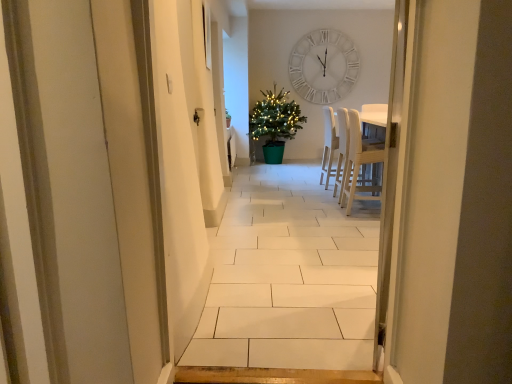
Measure the distance between point (276, 117) and camera.

Point (276, 117) is 6.53 meters from camera.

Image resolution: width=512 pixels, height=384 pixels. Identify the location of white wood chairs at center. (342, 148).

The image size is (512, 384). What do you see at coordinates (342, 148) in the screenshot?
I see `white wood chairs at center` at bounding box center [342, 148].

The height and width of the screenshot is (384, 512). Find the location of `light wood chair at center`. light wood chair at center is located at coordinates (360, 166).

Considering the relative sizes of green matte potted plant at center and light wood chair at center in the image provided, is green matte potted plant at center bigger than light wood chair at center?

Yes.

Considering the relative positions of green matte potted plant at center and light wood chair at center in the image provided, is green matte potted plant at center to the left of light wood chair at center from the viewer's perspective?

Indeed, green matte potted plant at center is positioned on the left side of light wood chair at center.

Which of these two, green matte potted plant at center or light wood chair at center, stands shorter?

With less height is light wood chair at center.

From the image's perspective, is green matte potted plant at center beneath light wood chair at center?

No.

What's the angular difference between light wood chair at center and white wooden clock at upper center's facing directions?

The facing directions of light wood chair at center and white wooden clock at upper center are 89.9 degrees apart.

In the scene shown: Considering the relative sizes of light wood chair at center and white wooden clock at upper center in the image provided, is light wood chair at center wider than white wooden clock at upper center?

Yes.

Is light wood chair at center positioned in front of white wooden clock at upper center?

Yes, it is in front of white wooden clock at upper center.

From the image's perspective, is light wood chair at center on white wooden clock at upper center?

Incorrect, from the image's perspective, light wood chair at center is lower than white wooden clock at upper center.

In the scene shown: From a real-world perspective, who is located lower, white wooden clock at upper center or light wood chair at center?

light wood chair at center.

Is white wooden clock at upper center next to light wood chair at center?

They are not placed beside each other.

Considering the relative sizes of white wooden clock at upper center and light wood chair at center in the image provided, is white wooden clock at upper center smaller than light wood chair at center?

Correct, white wooden clock at upper center occupies less space than light wood chair at center.

How much distance is there between white wooden clock at upper center and light wood chair at center?

white wooden clock at upper center is 2.50 meters from light wood chair at center.

Measure the distance between white wood chairs at center and white wooden clock at upper center.

white wood chairs at center is 2.12 meters from white wooden clock at upper center.

Considering the points (339, 180) and (304, 72), which point is behind, point (339, 180) or point (304, 72)?

Point (304, 72)

From the image's perspective, is white wood chairs at center on white wooden clock at upper center?

No, from the image's perspective, white wood chairs at center is not over white wooden clock at upper center.

Which object is wider, white wood chairs at center or white wooden clock at upper center?

white wood chairs at center is wider.

Between green matte potted plant at center and white wooden clock at upper center, which one is positioned in front?

green matte potted plant at center.

Can you confirm if green matte potted plant at center is shorter than white wooden clock at upper center?

No.

Can we say green matte potted plant at center lies outside white wooden clock at upper center?

Yes.

From a real-world perspective, is green matte potted plant at center located beneath white wooden clock at upper center?

Yes.

Which of these two, white wood chairs at center or green matte potted plant at center, is bigger?

green matte potted plant at center.

Is white wood chairs at center positioned beyond the bounds of green matte potted plant at center?

Absolutely, white wood chairs at center is external to green matte potted plant at center.

The width and height of the screenshot is (512, 384). What are the coordinates of `houseplant above the white wood chairs at center (from the image's perspective)` in the screenshot? It's located at pyautogui.click(x=274, y=123).

From their relative heights in the image, would you say white wood chairs at center is taller or shorter than green matte potted plant at center?

Clearly, white wood chairs at center is shorter compared to green matte potted plant at center.

Based on the photo, is light wood chair at center facing towards green matte potted plant at center?

No, light wood chair at center does not turn towards green matte potted plant at center.

From the picture: Considering the relative sizes of light wood chair at center and green matte potted plant at center in the image provided, is light wood chair at center shorter than green matte potted plant at center?

Correct, light wood chair at center is not as tall as green matte potted plant at center.

Considering the positions of objects light wood chair at center and green matte potted plant at center in the image provided, who is in front, light wood chair at center or green matte potted plant at center?

light wood chair at center.

How different are the orientations of light wood chair at center and green matte potted plant at center in degrees?

They differ by 91.6 degrees in their facing directions.

This screenshot has width=512, height=384. I want to click on houseplant that appears above the light wood chair at center (from a real-world perspective), so click(274, 123).

This screenshot has height=384, width=512. Find the location of `chair located underneath the white wooden clock at upper center (from a real-world perspective)`. chair located underneath the white wooden clock at upper center (from a real-world perspective) is located at coordinates (360, 166).

Which object lies nearer to the anchor point white wooden clock at upper center, green matte potted plant at center or light wood chair at center?

green matte potted plant at center is closer to white wooden clock at upper center.

Based on their spatial positions, is white wood chairs at center or light wood chair at center closer to green matte potted plant at center?

white wood chairs at center is closer to green matte potted plant at center.

Estimate the real-world distances between objects in this image. Which object is further from light wood chair at center, green matte potted plant at center or white wooden clock at upper center?

white wooden clock at upper center is positioned further to the anchor light wood chair at center.

Estimate the real-world distances between objects in this image. Which object is further from green matte potted plant at center, white wooden clock at upper center or white wood chairs at center?

white wood chairs at center is further to green matte potted plant at center.

Based on the photo, considering their positions, is green matte potted plant at center positioned closer to white wooden clock at upper center than white wood chairs at center?

green matte potted plant at center lies closer to white wooden clock at upper center than the other object.

Which object lies nearer to the anchor point white wooden clock at upper center, white wood chairs at center or green matte potted plant at center?

green matte potted plant at center is closer to white wooden clock at upper center.

Based on their spatial positions, is white wooden clock at upper center or green matte potted plant at center further from light wood chair at center?

white wooden clock at upper center.

From the image, which object appears to be farther from white wood chairs at center, light wood chair at center or green matte potted plant at center?

The object further to white wood chairs at center is green matte potted plant at center.

Locate an element on the screen. houseplant located between light wood chair at center and white wooden clock at upper center in the depth direction is located at coordinates (274, 123).

Identify the location of armchair between light wood chair at center and green matte potted plant at center in the front-back direction. This screenshot has height=384, width=512. (342, 148).

I want to click on houseplant between white wood chairs at center and white wooden clock at upper center along the z-axis, so click(x=274, y=123).

Find the location of a particular element. The width and height of the screenshot is (512, 384). armchair positioned between light wood chair at center and white wooden clock at upper center from near to far is located at coordinates (342, 148).